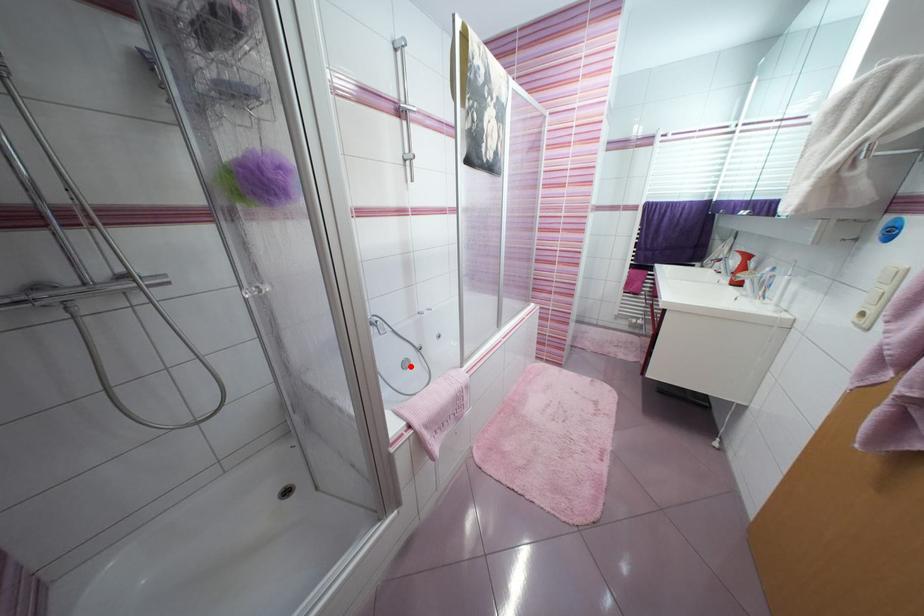
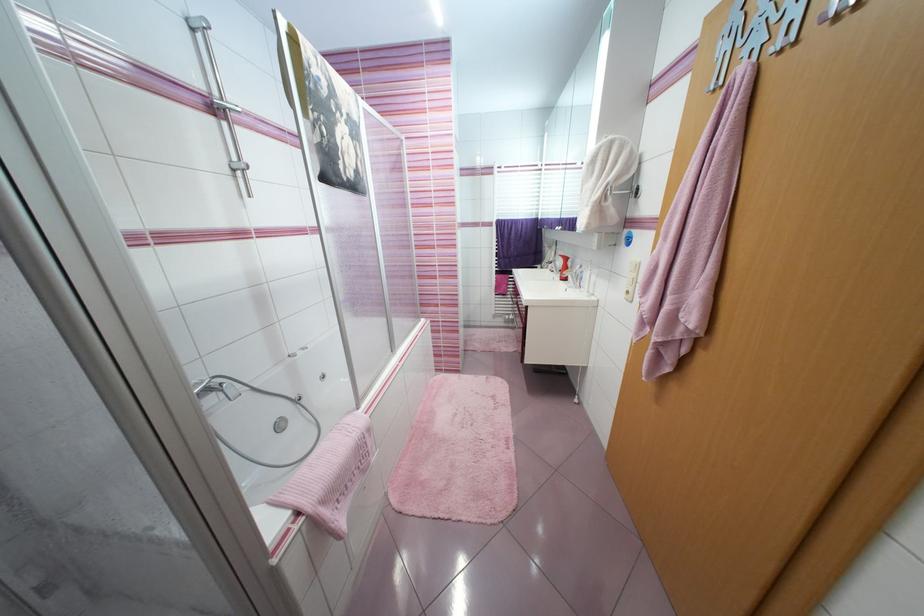
Question: I am providing you with two images of the same scene from different viewpoints. Image1 has a red point marked. In image2, the corresponding 3D location appears at what relative position? Reply with the corresponding letter.

Choices:
 (A) Closer
 (B) Farther

Answer: (A)